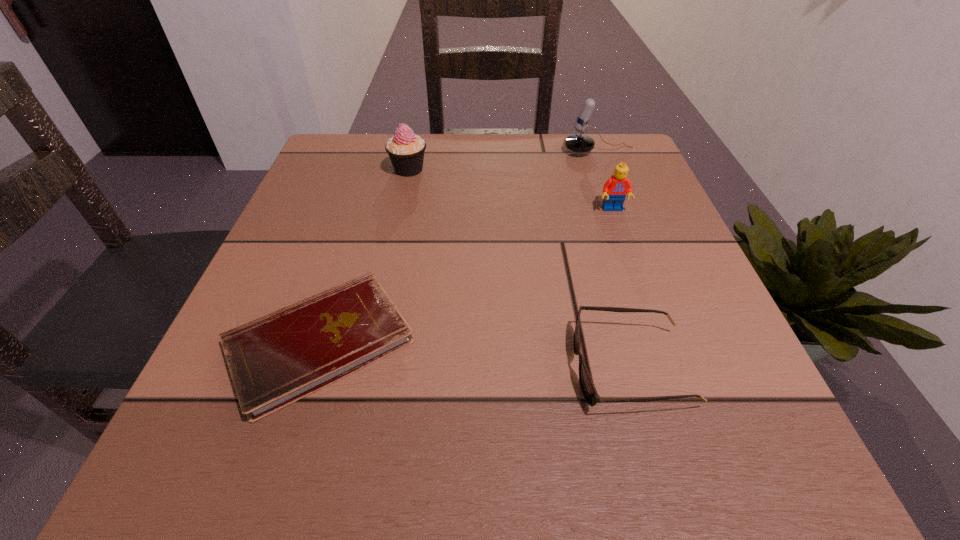
The image size is (960, 540). What are the coordinates of `microphone` in the screenshot? It's located at (579, 143).

Where is `the second farthest object`? the second farthest object is located at coordinates (406, 150).

Find the location of `the third farthest object`. the third farthest object is located at coordinates (615, 189).

The width and height of the screenshot is (960, 540). What are the coordinates of `the second shortest object` in the screenshot? It's located at (590, 394).

Locate an element on the screen. The image size is (960, 540). the shortest object is located at coordinates (275, 360).

Locate an element on the screen. This screenshot has width=960, height=540. free region located on the left of the microphone is located at coordinates (539, 152).

You are a GUI agent. You are given a task and a screenshot of the screen. Output one action in this format:
    pyautogui.click(x=<x>, y=<y>)
    Task: Click on the vacant space located 0.350m on the front of the fourth nearest object
    
    Given the screenshot: What is the action you would take?
    pyautogui.click(x=381, y=300)

Where is `vacant space situated on the face of the Lego`? vacant space situated on the face of the Lego is located at coordinates (677, 390).

Find the location of a particular element. The width and height of the screenshot is (960, 540). vacant space located on the lenses of the fourth tallest object is located at coordinates (468, 368).

Where is `blank area located on the lenses of the fourth tallest object`? This screenshot has height=540, width=960. blank area located on the lenses of the fourth tallest object is located at coordinates (340, 368).